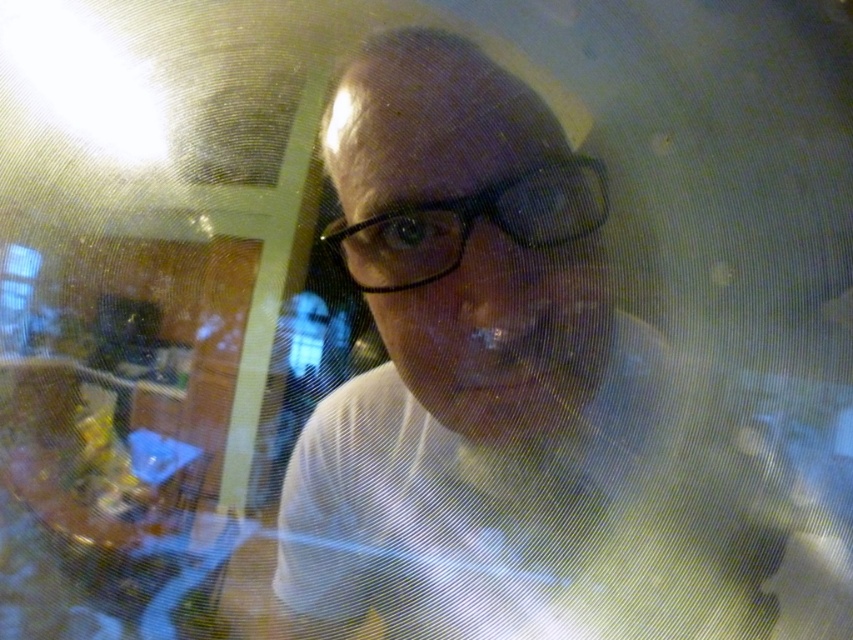
Question: Which object appears farthest from the camera in this image?

Choices:
 (A) white matte shirt at center
 (B) black plastic glasses at center

Answer: (B)

Question: Where is white matte shirt at center located in relation to black plastic glasses at center in the image?

Choices:
 (A) below
 (B) above

Answer: (A)

Question: Can you confirm if white matte shirt at center is positioned below black plastic glasses at center?

Choices:
 (A) yes
 (B) no

Answer: (A)

Question: Is white matte shirt at center closer to the viewer compared to black plastic glasses at center?

Choices:
 (A) yes
 (B) no

Answer: (A)